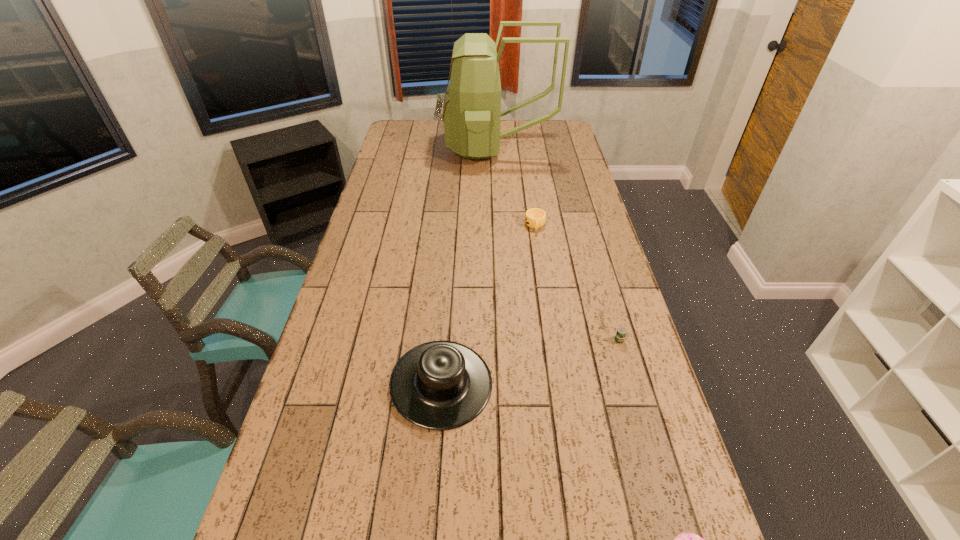
The width and height of the screenshot is (960, 540). I want to click on free space located 0.320m on the left of the cup, so click(x=441, y=226).

Find the location of a particular element. vacant space situated on the back of the third farthest object is located at coordinates click(597, 264).

Locate an element on the screen. object at the far edge is located at coordinates (471, 114).

Find the location of a particular element. backpack that is positioned at the right edge is located at coordinates (471, 114).

Identify the location of beer can that is at the right edge. The width and height of the screenshot is (960, 540). (620, 335).

Locate an element on the screen. This screenshot has width=960, height=540. object present at the far right corner is located at coordinates pos(471,114).

This screenshot has height=540, width=960. I want to click on vacant space at the far edge of the desktop, so click(531, 130).

Find the location of a particular element. Image resolution: width=960 pixels, height=540 pixels. vacant area at the left edge of the desktop is located at coordinates (409, 150).

Find the location of a particular element. The image size is (960, 540). free space at the right edge of the desktop is located at coordinates (569, 146).

In the image, there is a desktop. Where is `vacant area at the far left corner`? The height and width of the screenshot is (540, 960). vacant area at the far left corner is located at coordinates (392, 127).